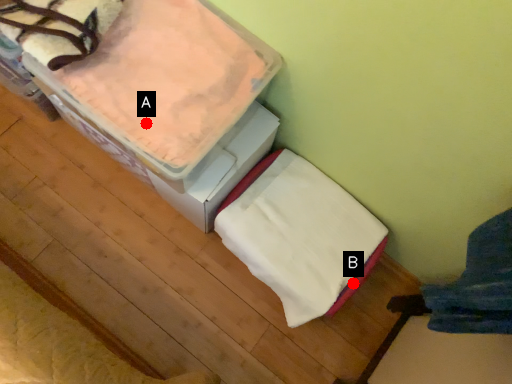
Question: Two points are circled on the image, labeled by A and B beside each circle. Which point is closer to the camera?

Choices:
 (A) A is closer
 (B) B is closer

Answer: (A)